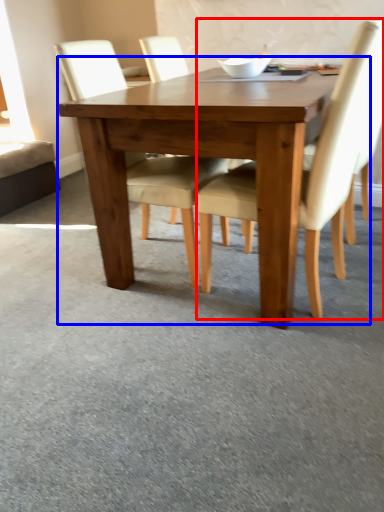
Question: Which object is closer to the camera taking this photo, chair (highlighted by a red box) or kitchen & dining room table (highlighted by a blue box)?

Choices:
 (A) chair
 (B) kitchen & dining room table

Answer: (A)